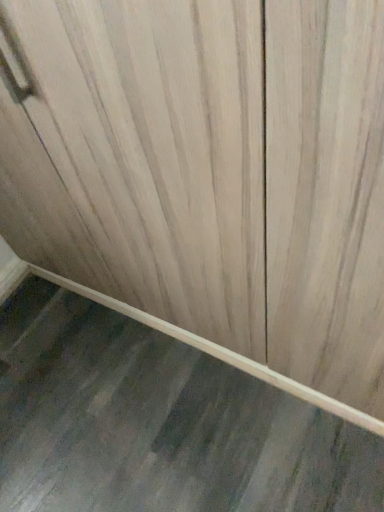
What is the approximate width of gray polished granite at lower left?

It is 27.93 inches.

What do you see at coordinates (158, 423) in the screenshot? I see `gray polished granite at lower left` at bounding box center [158, 423].

Find the location of `gray polished granite at lower left`. gray polished granite at lower left is located at coordinates (158, 423).

Measure the distance between point (267, 438) and camera.

3.97 feet.

Where is `gray polished granite at lower left`? gray polished granite at lower left is located at coordinates (158, 423).